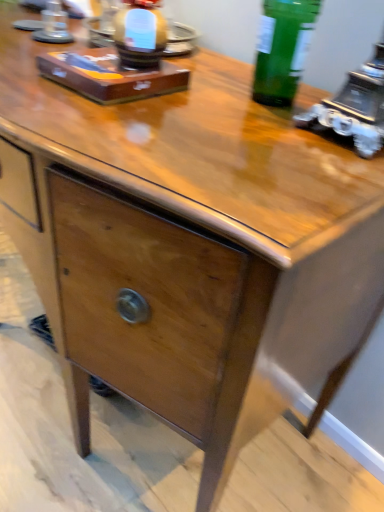
What do you see at coordinates (282, 49) in the screenshot? The image size is (384, 512). I see `green glass bottle at upper right` at bounding box center [282, 49].

Measure the distance between green glass bottle at upper right and camera.

The depth of green glass bottle at upper right is 25.69 inches.

The height and width of the screenshot is (512, 384). I want to click on green glass bottle at upper right, so click(282, 49).

I want to click on green glass bottle at upper right, so click(x=282, y=49).